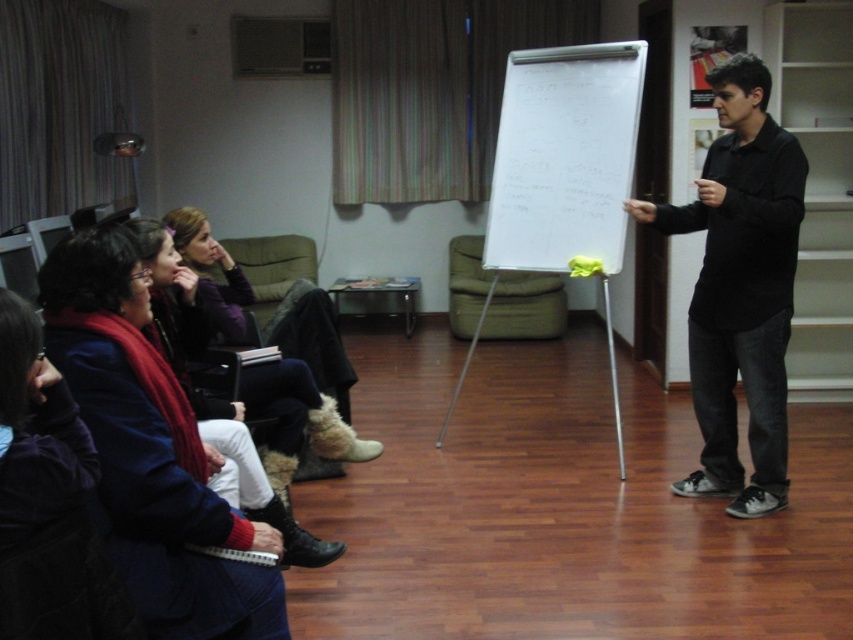
You are standing at the entrance of the room and want to quickly locate the whiteboard at center. Based on the coordinates provided, can you determine its position relative to the room?

The whiteboard at center is located at coordinates point (564, 156), which places it closer to the left side and slightly forward in the room from the center point.

You are sitting in the dark purple sweater at lower left and want to write something on the whiteboard at center. Which direction should you move to reach it?

The whiteboard at center is to the right of the dark purple sweater at lower left, so you should move to your right to reach it.

You are standing in the room and want to reach both the point at coordinates (720, 288) and the point at (45, 616). Which point will you reach first if you move directly towards them?

You will reach point (45, 616) first because it is closer to you than point (720, 288), which is further away.